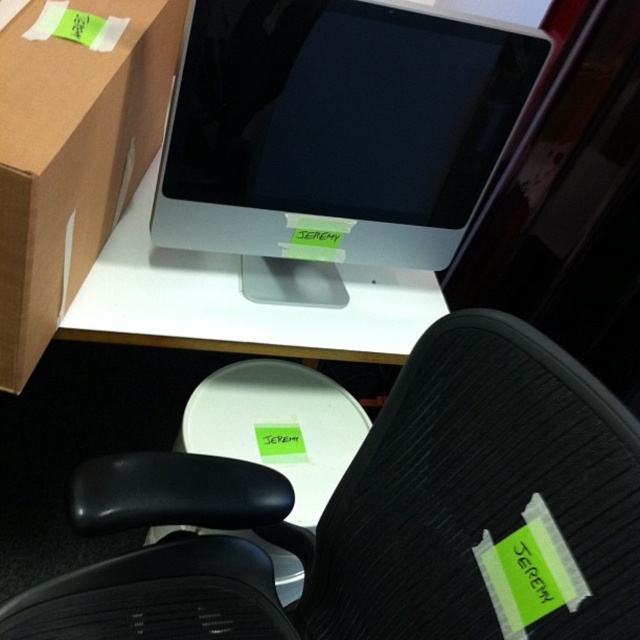
Question: Which is nearer to the sleek silver monitor at upper center?

Choices:
 (A) brown cardboard box at upper left
 (B) white glossy table at center

Answer: (B)

Question: Is brown cardboard box at upper left smaller than white glossy table at center?

Choices:
 (A) yes
 (B) no

Answer: (A)

Question: Can you confirm if sleek silver monitor at upper center is positioned above brown cardboard box at upper left?

Choices:
 (A) no
 (B) yes

Answer: (B)

Question: Estimate the real-world distances between objects in this image. Which object is farther from the white glossy table at center?

Choices:
 (A) black mesh swivel chair at center
 (B) sleek silver monitor at upper center

Answer: (A)

Question: Estimate the real-world distances between objects in this image. Which object is farther from the white glossy table at center?

Choices:
 (A) black mesh swivel chair at center
 (B) sleek silver monitor at upper center
 (C) brown cardboard box at upper left

Answer: (A)

Question: Can you confirm if sleek silver monitor at upper center is wider than white glossy table at center?

Choices:
 (A) no
 (B) yes

Answer: (A)